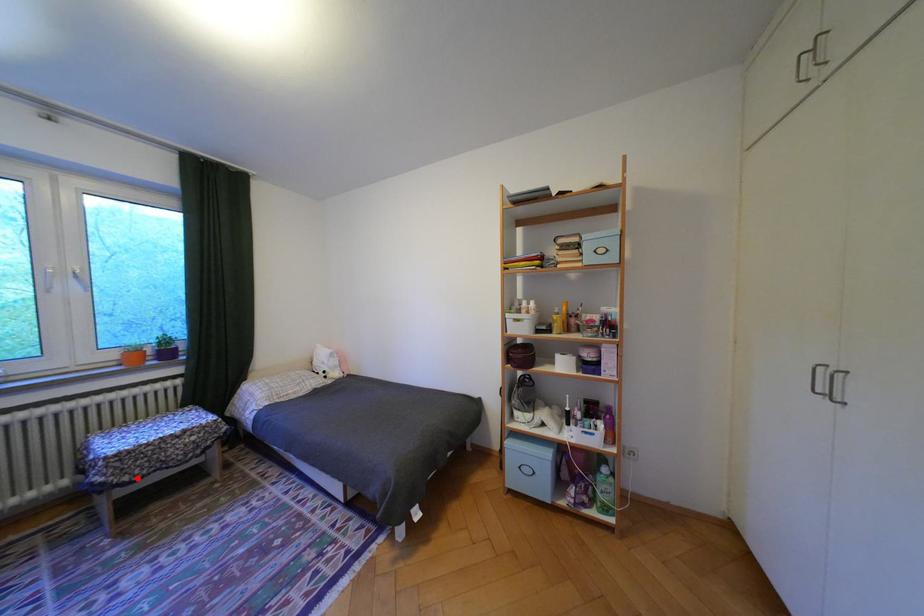
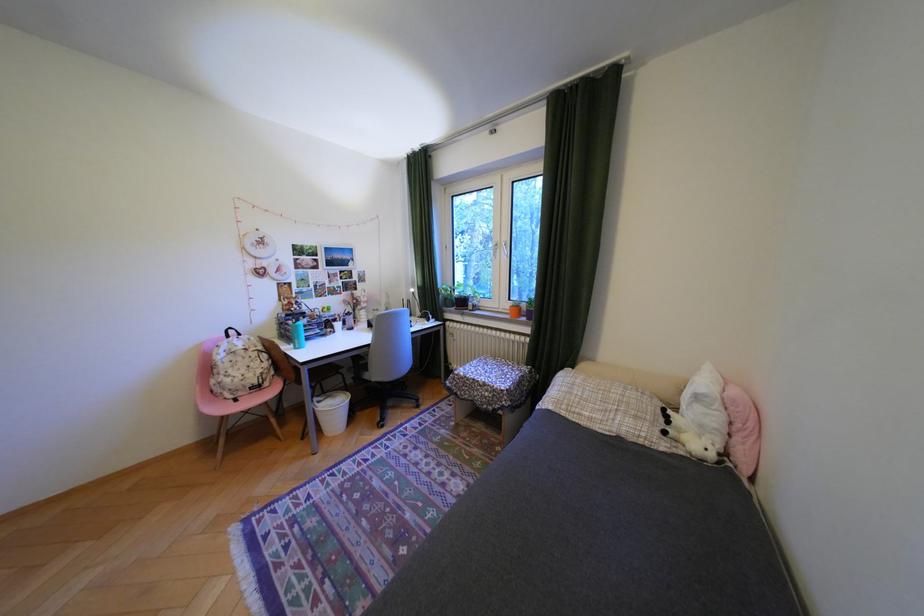
Where in the second image is the point corresponding to the highlighted location from the first image?

(470, 392)